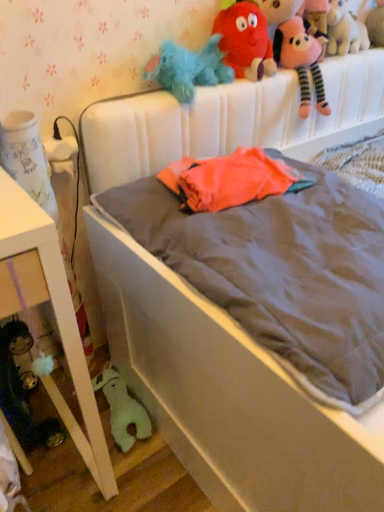
Question: From the image's perspective, would you say fluffy plush toys at upper right is shown under green plush toy at lower left, positioned as the first toy in left-to-right order?

Choices:
 (A) no
 (B) yes

Answer: (A)

Question: Is fluffy plush toys at upper right outside green plush toy at lower left, positioned as the first toy in bottom-to-top order?

Choices:
 (A) no
 (B) yes

Answer: (B)

Question: Is fluffy plush toys at upper right next to green plush toy at lower left, positioned as the first toy in left-to-right order, and touching it?

Choices:
 (A) yes
 (B) no

Answer: (B)

Question: Can you confirm if fluffy plush toys at upper right is positioned to the right of green plush toy at lower left, positioned as the first toy in bottom-to-top order?

Choices:
 (A) no
 (B) yes

Answer: (B)

Question: From a real-world perspective, is fluffy plush toys at upper right positioned under green plush toy at lower left, positioned as the first toy in left-to-right order, based on gravity?

Choices:
 (A) yes
 (B) no

Answer: (B)

Question: Considering the relative positions of white glossy nightstand at lower left and pink plush unicorn at upper right, marked as the 4th toy in a bottom-to-top arrangement, in the image provided, is white glossy nightstand at lower left to the left or to the right of pink plush unicorn at upper right, marked as the 4th toy in a bottom-to-top arrangement,?

Choices:
 (A) right
 (B) left

Answer: (B)

Question: From a real-world perspective, is white glossy nightstand at lower left physically located above or below pink plush unicorn at upper right, acting as the second toy starting from the top?

Choices:
 (A) above
 (B) below

Answer: (B)

Question: In terms of size, does white glossy nightstand at lower left appear bigger or smaller than pink plush unicorn at upper right, which appears as the second toy when viewed from the right?

Choices:
 (A) big
 (B) small

Answer: (A)

Question: From the image's perspective, is white glossy nightstand at lower left located above or below pink plush unicorn at upper right, acting as the second toy starting from the top?

Choices:
 (A) below
 (B) above

Answer: (A)

Question: Is fluffy plush toys at upper right situated inside pink plush unicorn at upper right, acting as the second toy starting from the top, or outside?

Choices:
 (A) outside
 (B) inside

Answer: (A)

Question: Is fluffy plush toys at upper right in front of or behind pink plush unicorn at upper right, which appears as the second toy when viewed from the right, in the image?

Choices:
 (A) front
 (B) behind

Answer: (A)

Question: From a real-world perspective, is fluffy plush toys at upper right physically located above or below pink plush unicorn at upper right, which appears as the second toy when viewed from the right?

Choices:
 (A) below
 (B) above

Answer: (A)

Question: Is fluffy plush toys at upper right wider or thinner than pink plush unicorn at upper right, which appears as the second toy when viewed from the right?

Choices:
 (A) thin
 (B) wide

Answer: (B)

Question: In terms of width, does green plush toy at lower left, positioned as the first toy in left-to-right order, look wider or thinner when compared to pink plush unicorn at upper right, the fourth toy in the left-to-right sequence?

Choices:
 (A) thin
 (B) wide

Answer: (B)

Question: Is green plush toy at lower left, the fifth toy from the top, bigger or smaller than pink plush unicorn at upper right, which appears as the second toy when viewed from the right?

Choices:
 (A) big
 (B) small

Answer: (B)